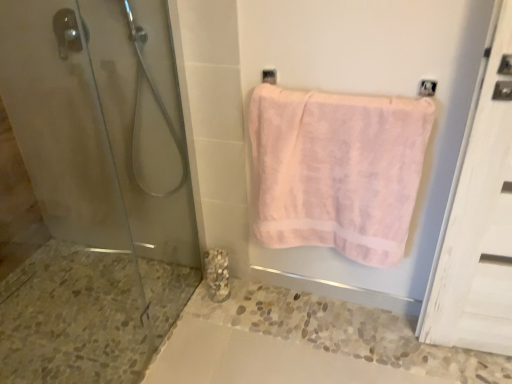
You are a GUI agent. You are given a task and a screenshot of the screen. Output one action in this format:
    pyautogui.click(x=<x>, y=<y>)
    Task: Click on the vacant space positioned to the left of transparent glass shower door at left
    Image resolution: width=512 pixels, height=384 pixels.
    Given the screenshot: What is the action you would take?
    pyautogui.click(x=80, y=344)